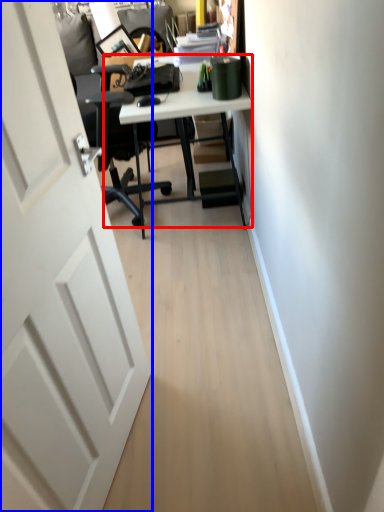
Question: Which of the following is the farthest to the observer, desk (highlighted by a red box) or door (highlighted by a blue box)?

Choices:
 (A) desk
 (B) door

Answer: (A)